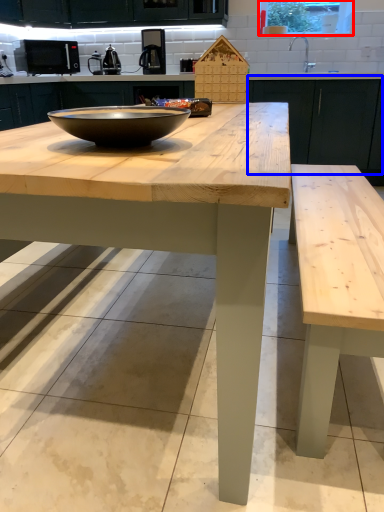
Question: Which object appears farthest to the camera in this image, window screen (highlighted by a red box) or cabinetry (highlighted by a blue box)?

Choices:
 (A) window screen
 (B) cabinetry

Answer: (A)